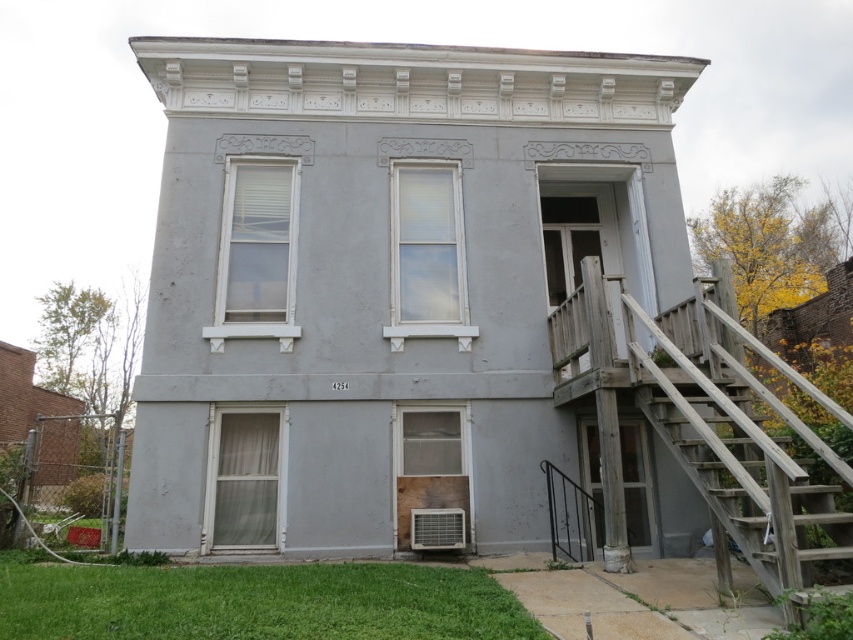
You are a delivery person with a box that is 5 feet long. You need to carry it up the weathered wood stairs at right while avoiding the black metal rail at lower right. Can you safely navigate the stairs without the box hitting the rail?

The distance between the weathered wood stairs at right and the black metal rail at lower right is 6.63 feet, which is greater than the length of the box. Therefore, you can safely carry the box up the stairs without it hitting the rail.

You are standing at the entrance of the building and want to go up to the second floor. You see the weathered wood stairs at right and the black metal rail at lower right. Which object should you hold onto for support while climbing the stairs?

You should hold onto the black metal rail at lower right for support while climbing the stairs because it is positioned on the left side of the weathered wood stairs at right, making it accessible for gripping.